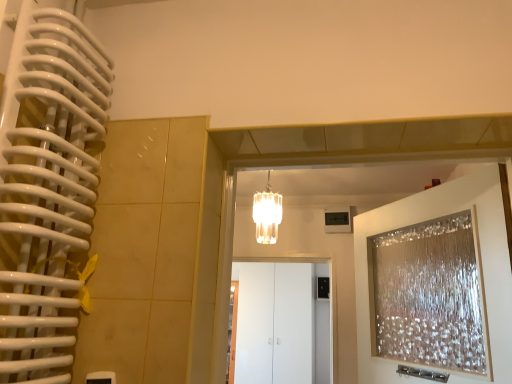
Question: From a real-world perspective, does translucent glass chandelier at center sit lower than translucent glass door at upper right?

Choices:
 (A) no
 (B) yes

Answer: (A)

Question: Can you confirm if translucent glass chandelier at center is taller than translucent glass door at upper right?

Choices:
 (A) no
 (B) yes

Answer: (A)

Question: Is translucent glass chandelier at center outside translucent glass door at upper right?

Choices:
 (A) no
 (B) yes

Answer: (B)

Question: Considering the relative sizes of translucent glass chandelier at center and translucent glass door at upper right in the image provided, is translucent glass chandelier at center wider than translucent glass door at upper right?

Choices:
 (A) yes
 (B) no

Answer: (A)

Question: Is translucent glass chandelier at center turned away from translucent glass door at upper right?

Choices:
 (A) yes
 (B) no

Answer: (B)

Question: Looking at the image, does white glossy cabinet at center seem bigger or smaller compared to translucent glass door at upper right?

Choices:
 (A) big
 (B) small

Answer: (A)

Question: In the image, is white glossy cabinet at center positioned in front of or behind translucent glass door at upper right?

Choices:
 (A) behind
 (B) front

Answer: (A)

Question: From a real-world perspective, is white glossy cabinet at center above or below translucent glass door at upper right?

Choices:
 (A) below
 (B) above

Answer: (A)

Question: From their relative heights in the image, would you say white glossy cabinet at center is taller or shorter than translucent glass door at upper right?

Choices:
 (A) tall
 (B) short

Answer: (A)

Question: From the image's perspective, relative to translucent glass chandelier at center, is translucent glass door at upper right above or below?

Choices:
 (A) below
 (B) above

Answer: (A)

Question: Relative to translucent glass chandelier at center, is translucent glass door at upper right in front or behind?

Choices:
 (A) front
 (B) behind

Answer: (A)

Question: Considering the relative positions of translucent glass door at upper right and translucent glass chandelier at center in the image provided, is translucent glass door at upper right to the left or to the right of translucent glass chandelier at center?

Choices:
 (A) right
 (B) left

Answer: (A)

Question: Is point (415, 203) positioned closer to the camera than point (268, 200)?

Choices:
 (A) closer
 (B) farther

Answer: (A)

Question: Is translucent glass chandelier at center in front of or behind white glossy cabinet at center in the image?

Choices:
 (A) behind
 (B) front

Answer: (B)

Question: From the image's perspective, is translucent glass chandelier at center located above or below white glossy cabinet at center?

Choices:
 (A) above
 (B) below

Answer: (A)